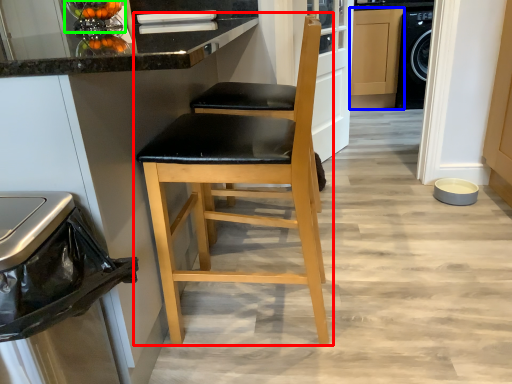
Question: Which object is the closest to the chair (highlighted by a red box)? Choose among these: cabinetry (highlighted by a blue box) or appliance (highlighted by a green box).

Choices:
 (A) cabinetry
 (B) appliance

Answer: (B)